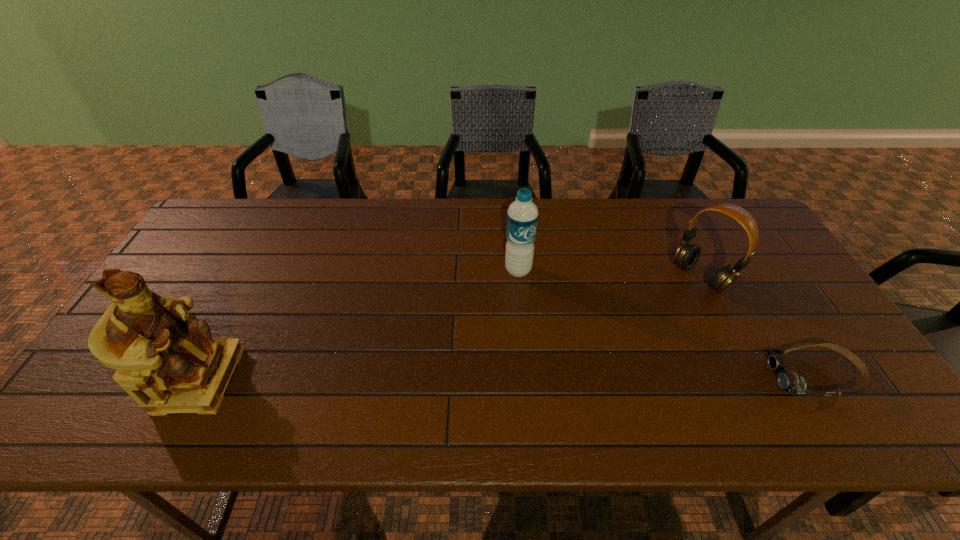
In order to click on empty space that is in between the goggles and the second tallest object in this screenshot , I will do tap(666, 323).

Locate an element on the screen. This screenshot has width=960, height=540. free space between the second shortest object and the shortest object is located at coordinates (757, 327).

Identify the location of unoccupied area between the shortest object and the water bottle. The image size is (960, 540). (666, 323).

Identify the location of vacant area that lies between the shortest object and the third shortest object. (666, 323).

Identify the location of object that is the closest to the shortest object. pyautogui.click(x=687, y=255).

You are a GUI agent. You are given a task and a screenshot of the screen. Output one action in this format:
    pyautogui.click(x=<x>, y=<y>)
    Task: Click on the object that is the second closest to the third tallest object
    
    Given the screenshot: What is the action you would take?
    pyautogui.click(x=522, y=215)

At what (x,y) coordinates should I click in order to perform the action: click on vacant area in the image that satisfies the following two spatial constraints: 1. on the front side of the shortest object; 2. on the front-facing side of the water bottle. Please return your answer as a coordinate pair (x, y). The width and height of the screenshot is (960, 540). Looking at the image, I should click on (527, 376).